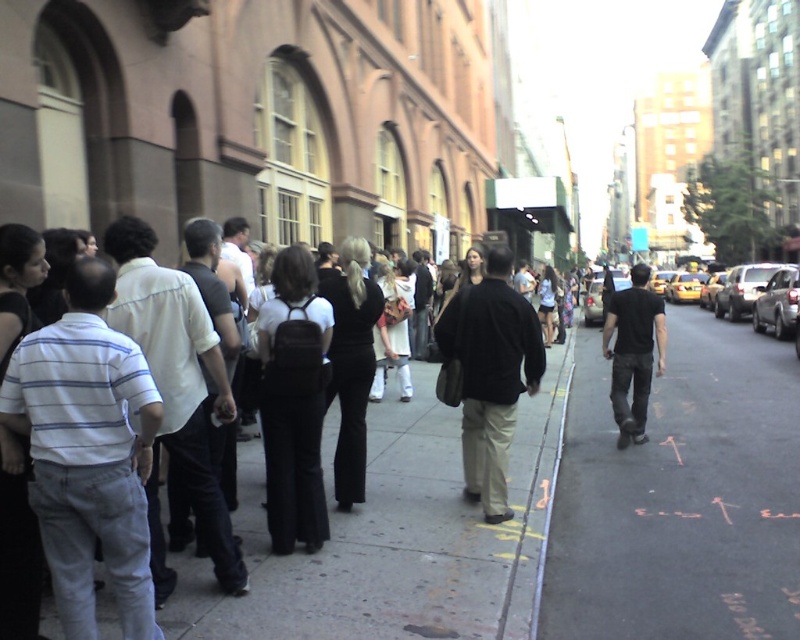
You are standing at the point with coordinates point (630, 328) and want to walk to the point with coordinates point (504, 356). Which direction should you move relative to your current position?

You should move forward because point (504, 356) is in front of point (630, 328).

You are a photographer trying to capture a candid shot of the black matte pants at center and the white striped shirt at left. Since you want both subjects to be in focus, you need to ensure they are within your camera lens depth of field. Given that the depth of field can only cover a certain distance, which subject is closer to the camera so you can adjust accordingly?

The white striped shirt at left is closer to the camera than the black matte pants at center, so you should focus on the white striped shirt at left to ensure both are in focus.

You are standing on the sidewalk in the image and see a point marked at coordinates (490, 374). What object is this point located on?

The point at coordinates (490, 374) is located on the dark brown leather jacket at center.